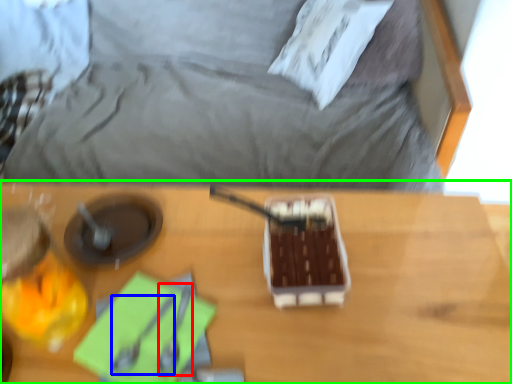
Question: Which object is the farthest from utensil (highlighted by a red box)? Choose among these: utensil (highlighted by a blue box) or table (highlighted by a green box).

Choices:
 (A) utensil
 (B) table

Answer: (B)